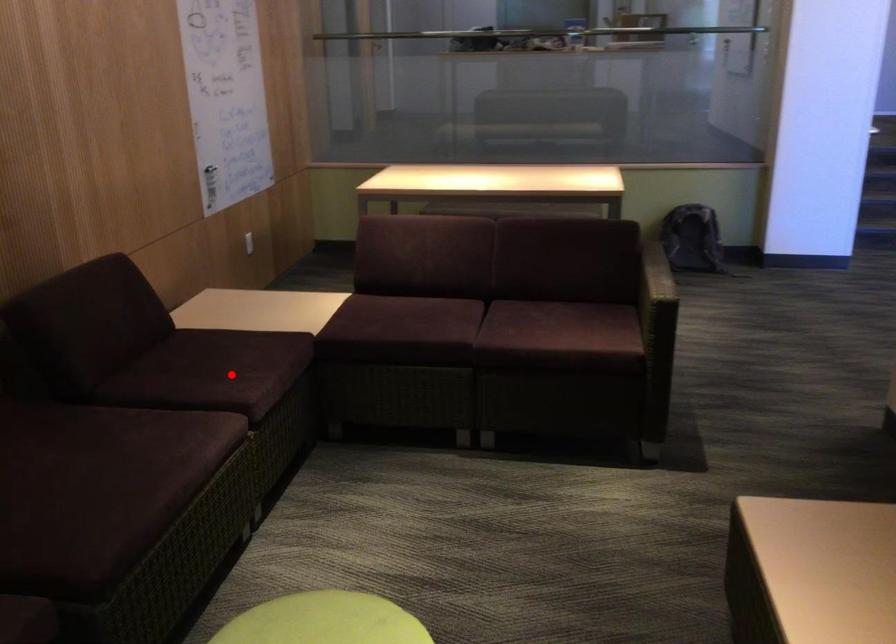
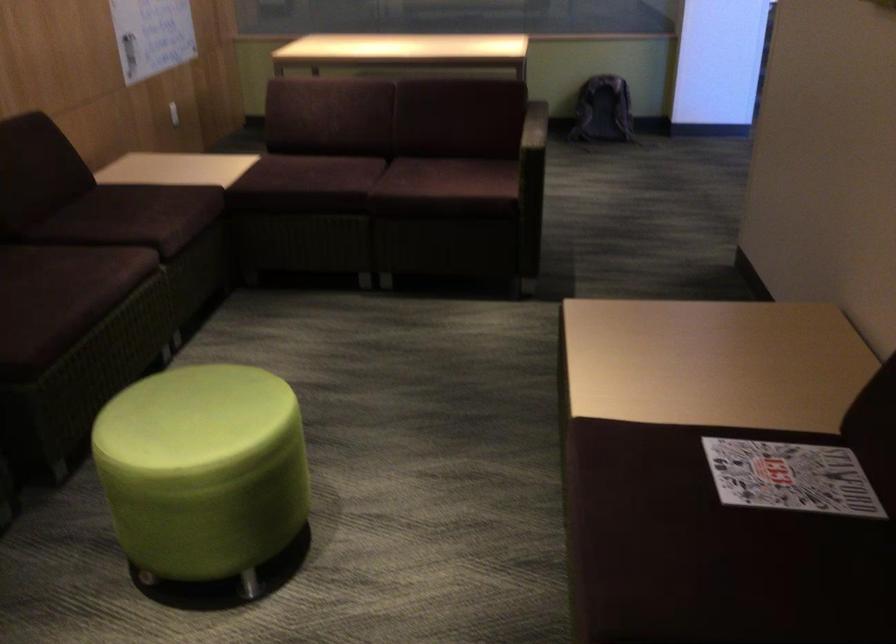
In the second image, find the point that corresponds to the highlighted location in the first image.

(147, 214)